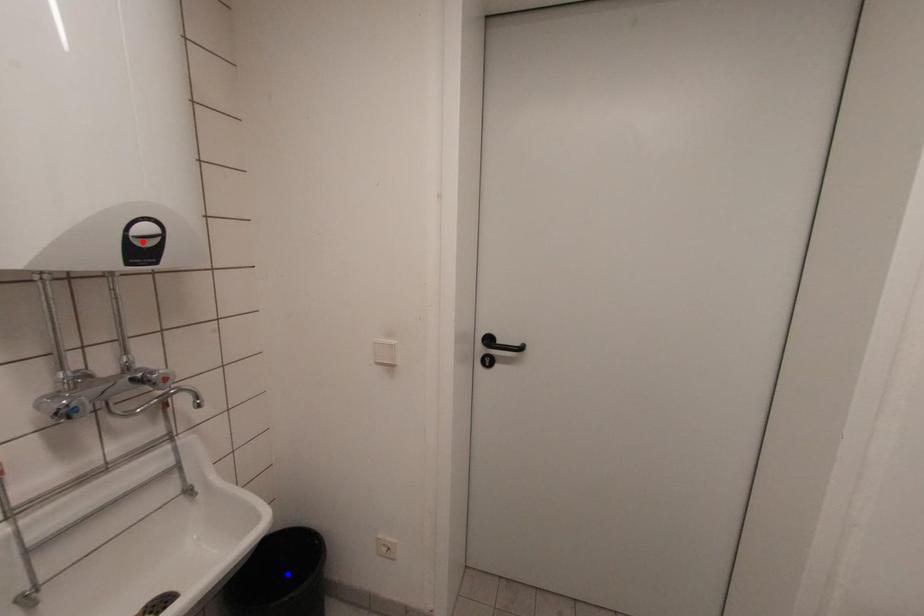
Question: Two points are marked on the image. Which point is closer to the camera?

Choices:
 (A) Blue point is closer.
 (B) Red point is closer.

Answer: (B)